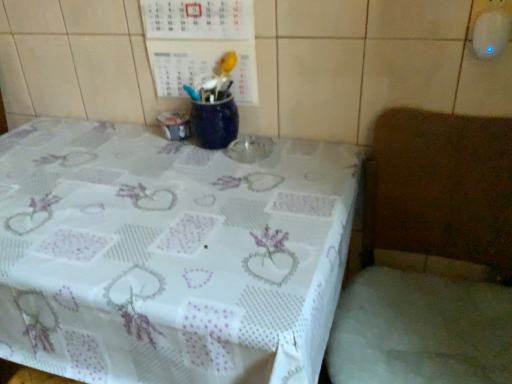
Where is `vacant area on top of white lace tablecloth at center (from a real-world perspective)`? vacant area on top of white lace tablecloth at center (from a real-world perspective) is located at coordinates (150, 191).